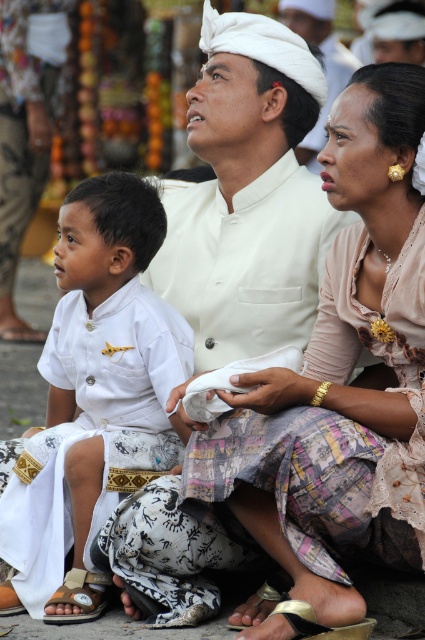
Who is higher up, white matte shirt at left or brown leather sandal at lower left?

white matte shirt at left is higher up.

Does white matte shirt at left have a greater height compared to brown leather sandal at lower left?

No.

Who is more distant from viewer, (36,557) or (56,618)?

Positioned behind is point (36,557).

Locate an element on the screen. The height and width of the screenshot is (640, 425). white matte shirt at left is located at coordinates (102, 358).

In the scene shown: Does white matte shirt at left appear on the left side of white cloth at center?

Indeed, white matte shirt at left is positioned on the left side of white cloth at center.

Is white matte shirt at left thinner than white cloth at center?

Yes.

Between point (99, 362) and point (334, 38), which one is positioned behind?

Point (334, 38)

The width and height of the screenshot is (425, 640). What are the coordinates of `white matte shirt at left` in the screenshot? It's located at (102, 358).

Is point (351, 323) closer to camera compared to point (84, 536)?

No, it is behind (84, 536).

Does matte white dress at center have a greater width compared to white matte shirt at left?

Incorrect, matte white dress at center's width does not surpass white matte shirt at left's.

Locate an element on the screen. This screenshot has height=640, width=425. matte white dress at center is located at coordinates (340, 376).